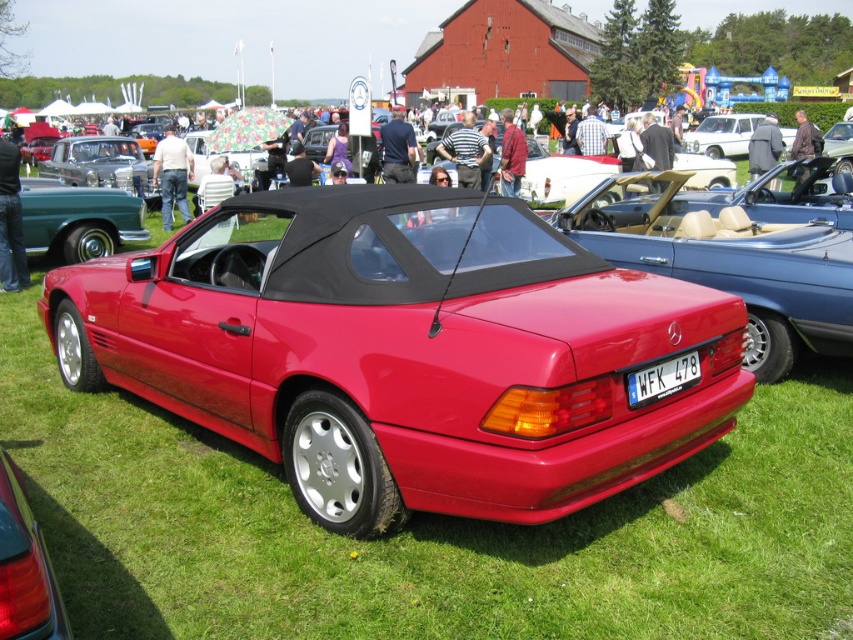
Question: Is matte red convertible at center above shiny silver sedan at left?

Choices:
 (A) yes
 (B) no

Answer: (B)

Question: Where is matte red convertible at center located in relation to white plastic license plate at center in the image?

Choices:
 (A) left
 (B) right

Answer: (A)

Question: Estimate the real-world distances between objects in this image. Which object is farther from the shiny silver sedan at left?

Choices:
 (A) matte red convertible at center
 (B) metallic silver convertible at center
 (C) white plastic license plate at center

Answer: (B)

Question: Which object is farther from the camera taking this photo?

Choices:
 (A) matte red convertible at center
 (B) shiny silver sedan at left

Answer: (B)

Question: Can you confirm if matte red convertible at center is bigger than white plastic license plate at center?

Choices:
 (A) no
 (B) yes

Answer: (B)

Question: Which point appears farthest from the camera in this image?

Choices:
 (A) (112, 173)
 (B) (787, 134)
 (C) (590, 426)
 (D) (633, 397)

Answer: (B)